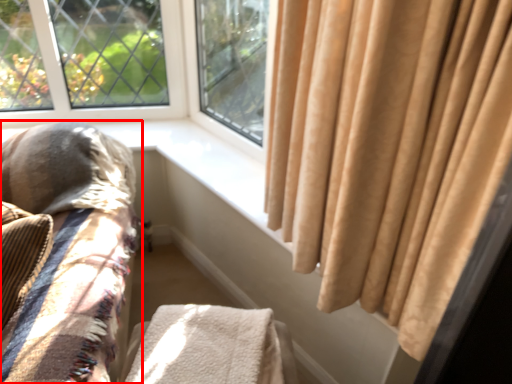
Question: From the image's perspective, what is the correct spatial positioning of furniture (annotated by the red box) in reference to blanket?

Choices:
 (A) above
 (B) below

Answer: (A)